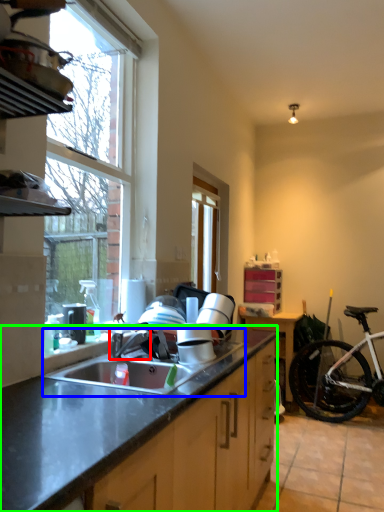
Question: Which object is positioned closest to faucet (highlighted by a red box)? Select from sink (highlighted by a blue box) and countertop (highlighted by a green box).

Choices:
 (A) sink
 (B) countertop

Answer: (A)